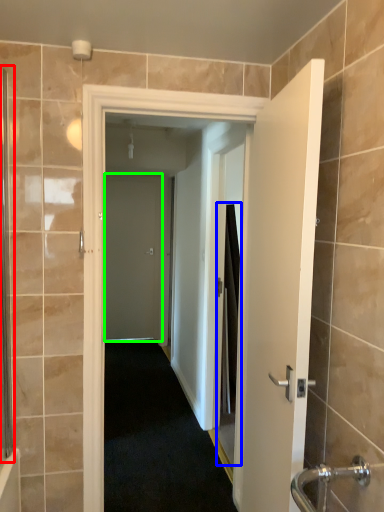
Question: Considering the real-world distances, which object is farthest from screen door (highlighted by a red box)? screen door (highlighted by a blue box) or door (highlighted by a green box)?

Choices:
 (A) screen door
 (B) door

Answer: (B)